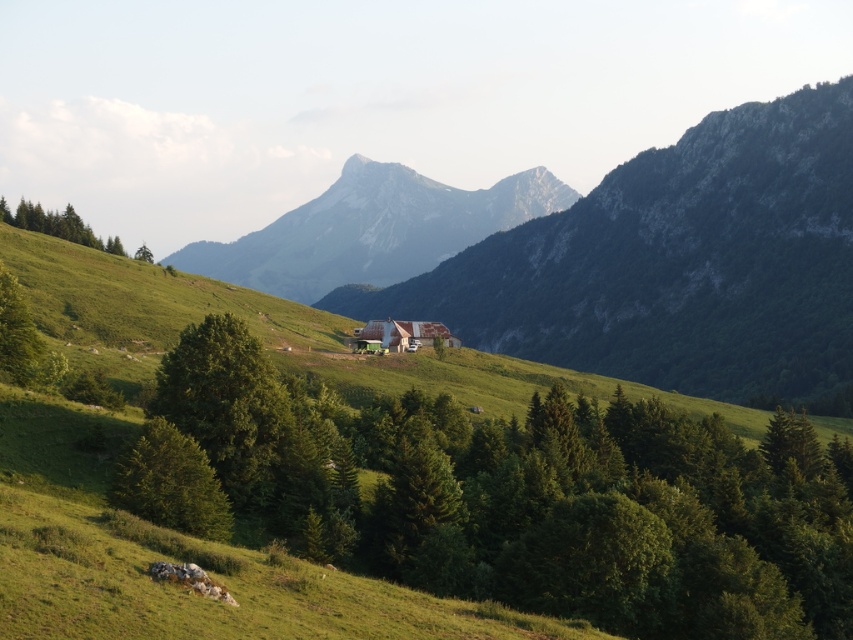
Does point (341, 272) come in front of point (51, 212)?

No, it is not.

Is gray rocky mountain at center positioned at the back of green matte tree at upper left?

Yes.

Is point (316, 280) farther from viewer compared to point (90, 243)?

Yes, it is behind point (90, 243).

Identify the location of gray rocky mountain at center. (372, 228).

Does green matte tree at center appear under green matte tree at lower left?

Yes.

Between point (236, 470) and point (190, 486), which one is positioned behind?

The point (236, 470) is behind.

Who is more forward, (666, 531) or (151, 445)?

Point (151, 445) is more forward.

Identify the location of green matte tree at center. (532, 497).

Does green matte tree at center have a greater height compared to green matte tree at upper left?

Yes, green matte tree at center is taller than green matte tree at upper left.

Can you confirm if green matte tree at center is positioned to the left of green matte tree at upper left?

No, green matte tree at center is not to the left of green matte tree at upper left.

Between point (482, 486) and point (25, 211), which one is positioned in front?

Point (482, 486) is in front.

The height and width of the screenshot is (640, 853). What are the coordinates of `green matte tree at center` in the screenshot? It's located at (532, 497).